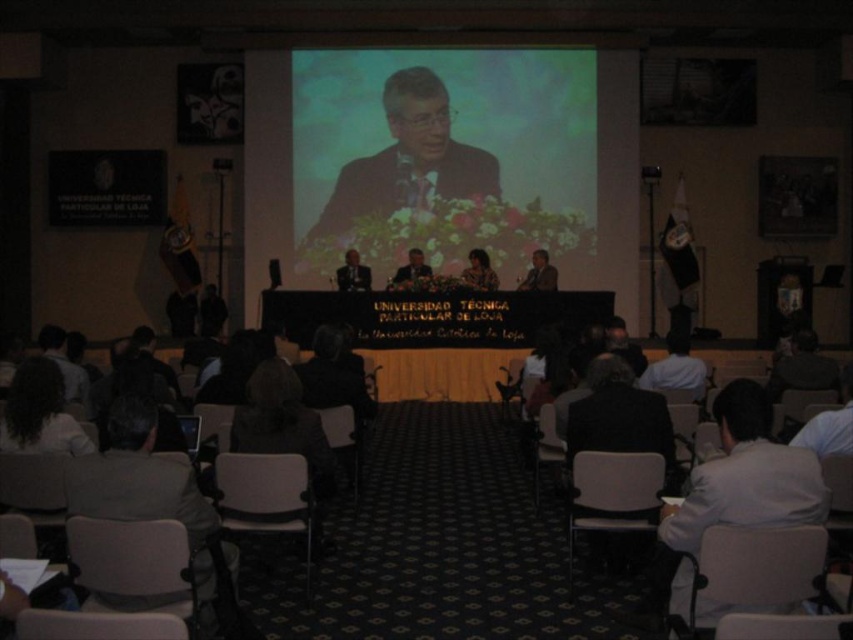
You are an event organizer who needs to place a 25 feet long banner between the white shirt at lower right and the matte black suit at center. Will the banner fit without overlapping either object?

The distance between the white shirt at lower right and the matte black suit at center is 27.50 feet. Since the banner is 25 feet long, it will fit between them without overlapping either object as there is sufficient space.

You are standing at the camera position and want to place a new microphone on the table at point (x=788, y=476). The existing microphones are placed at points that are 8.5 feet away from the camera. Will the new microphone be closer or farther from the camera compared to the existing ones?

The point (x=788, y=476) is 9.67 feet from the camera, which is farther than the existing microphones at 8.5 feet. Therefore, the new microphone will be farther away from the camera than the existing ones.